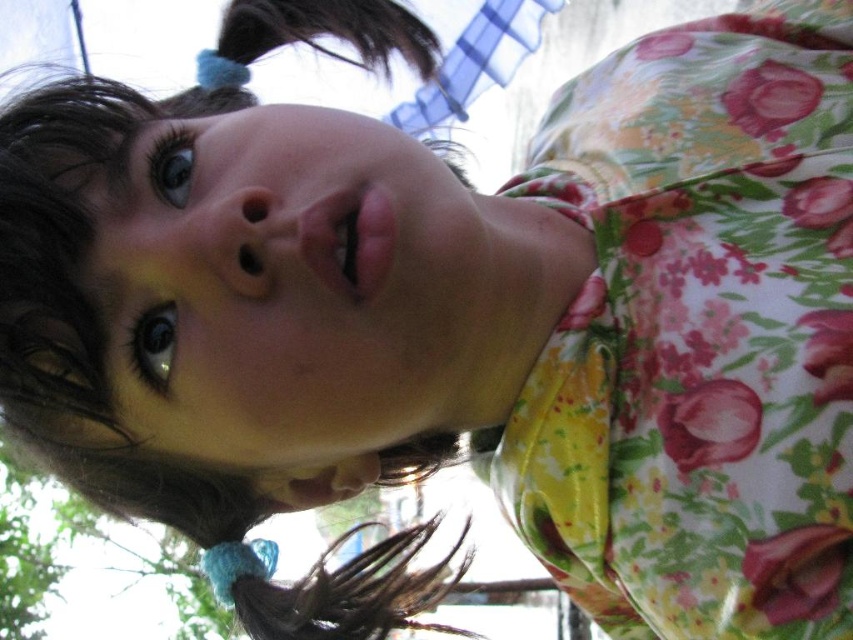
You are taking a photo of the girl and want to focus on two specific points in the image. The first is point (612, 310) and the second is point (360, 29). Which point is closer to you?

Point (612, 310) is closer to the viewer than point (360, 29).

Based on the scene description, can you determine which object is placed higher between the floral fabric dress at upper center and the blue fabric hair at upper center?

The blue fabric hair at upper center is higher because it is positioned above the floral fabric dress at upper center.